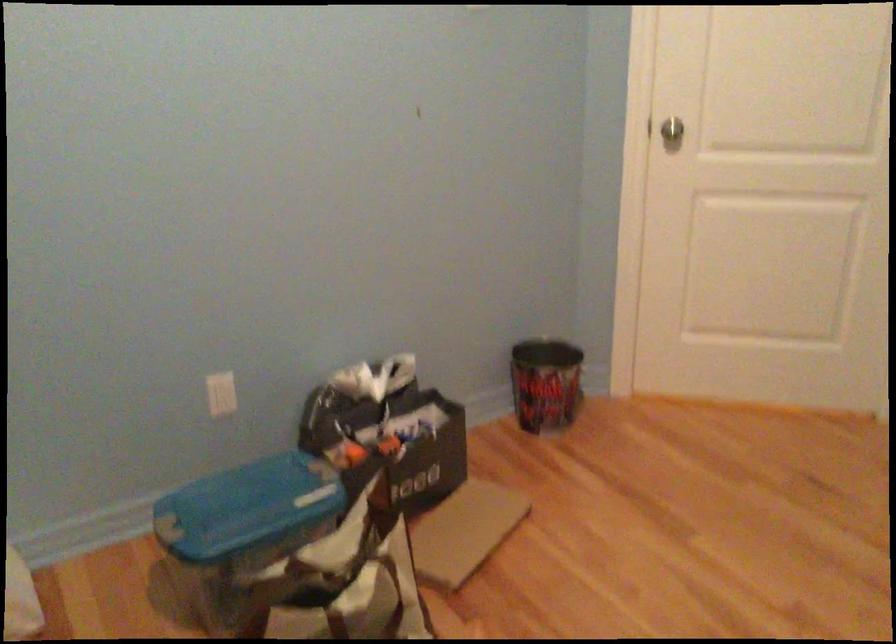
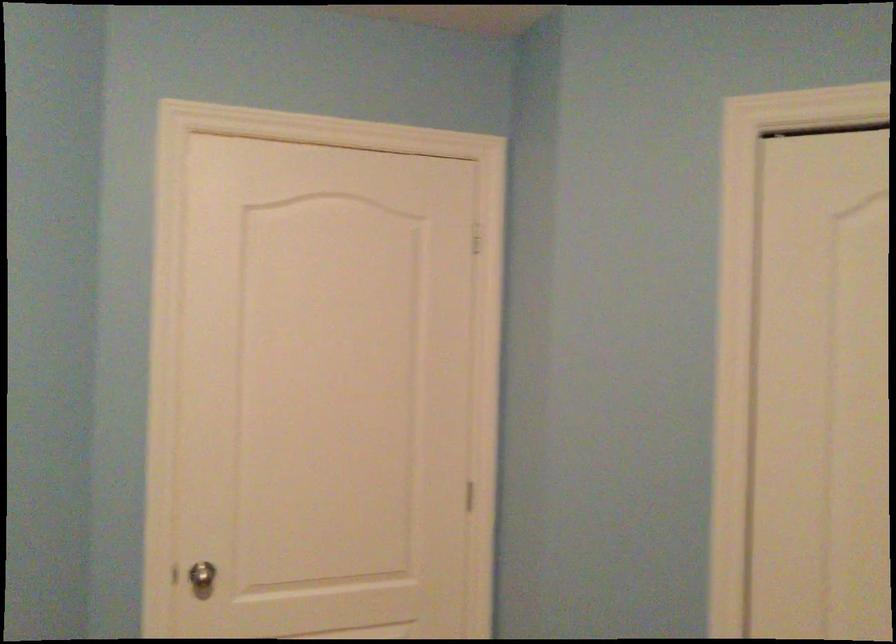
First-person continuous shooting, in which direction is the camera rotating?

The camera rotated toward right-up.